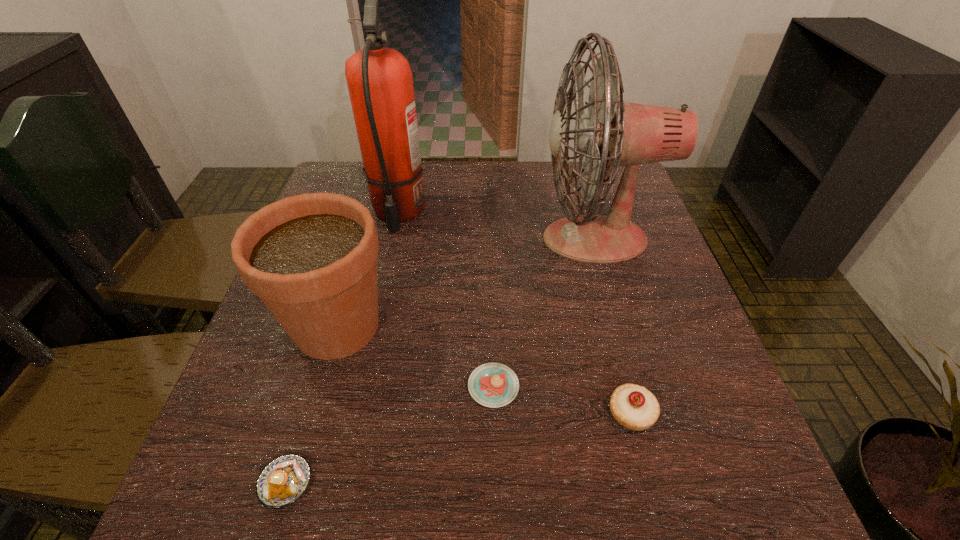
You are a GUI agent. You are given a task and a screenshot of the screen. Output one action in this format:
    pyautogui.click(x=<x>, y=<y>)
    Task: Click on the free space located in front of the fan to direct airflow
    
    Given the screenshot: What is the action you would take?
    pyautogui.click(x=469, y=239)

Locate an element on the screen. Image resolution: width=960 pixels, height=540 pixels. vacant space located 0.070m in front of the fan to direct airflow is located at coordinates (510, 239).

Locate an element on the screen. The height and width of the screenshot is (540, 960). free space located 0.230m on the front of the flowerpot is located at coordinates (284, 507).

Find the location of a particular element. free location located 0.400m on the back of the tallest pastry is located at coordinates (588, 247).

What are the coordinates of `vacant area situated on the right of the third object from right to left` in the screenshot? It's located at (574, 387).

The height and width of the screenshot is (540, 960). I want to click on free region located 0.220m on the back of the nearest pastry, so click(326, 346).

I want to click on fire extinguisher positioned at the far edge, so click(x=380, y=83).

In order to click on fan located at the far edge in this screenshot , I will do `click(614, 133)`.

In order to click on object situated at the near edge in this screenshot , I will do `click(282, 481)`.

I want to click on fire extinguisher situated at the left edge, so click(x=380, y=83).